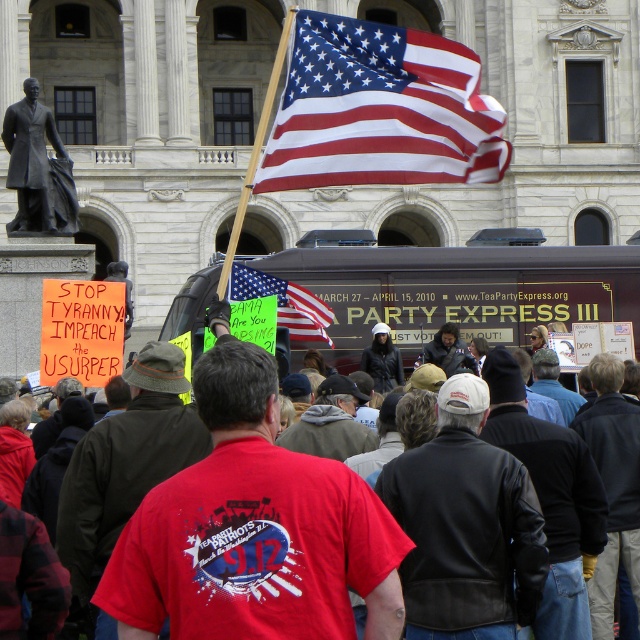
You are a photographer at the event and want to capture both the red cotton shirt at center and the bronze statue at left in the same frame. Given that your camera has a 50mm lens, which has a field of view of approximately 46 degrees, can you estimate if both objects will fit in the frame without moving the camera?

The red cotton shirt at center is 87.22 feet from bronze statue at left. To determine if both fit in the 46 degree field of view, we can calculate the angular separation. Using trigonometry, if the distance between them is 87.22 feet, the angle would be arctangent of 87.22 divided by the distance from the camera to the objects. However, without knowing the exact distance from the camera to the objects, we cannot definitively confirm if they fit within the 46 degree field of view.

Looking at this image, you are a photographer at the event and want to capture both the red cotton shirt at center and the american flag at upper center in a single shot. Which object should you focus on first to ensure both are in frame?

The red cotton shirt at center has a lesser height compared to the american flag at upper center, so you should focus on the american flag at upper center first to ensure both are in frame.